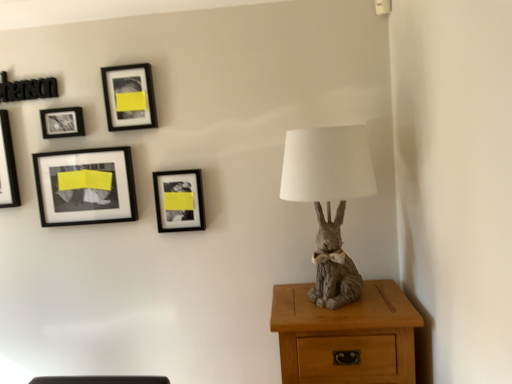
Question: Should I look upward or downward to see black matte picture frame at upper center, the fourth picture frame viewed from the left?

Choices:
 (A) up
 (B) down

Answer: (A)

Question: Is black matte picture frame at upper center, the 2th picture frame in the right-to-left sequence, at the left side of matte black frame at center, the first picture frame viewed from the right?

Choices:
 (A) yes
 (B) no

Answer: (A)

Question: Is the surface of black matte picture frame at upper center, the fourth picture frame viewed from the left, in direct contact with matte black frame at center, the first picture frame viewed from the right?

Choices:
 (A) no
 (B) yes

Answer: (A)

Question: From the image's perspective, does black matte picture frame at upper center, the fourth picture frame viewed from the left, appear lower than matte black frame at center, the first picture frame viewed from the right?

Choices:
 (A) no
 (B) yes

Answer: (A)

Question: Is black matte picture frame at upper center, the fourth picture frame viewed from the left, smaller than matte black frame at center, positioned as the fifth picture frame in left-to-right order?

Choices:
 (A) yes
 (B) no

Answer: (B)

Question: From a real-world perspective, does black matte picture frame at upper center, the 2th picture frame in the right-to-left sequence, stand above matte black frame at center, the first picture frame viewed from the right?

Choices:
 (A) yes
 (B) no

Answer: (A)

Question: Is black matte picture frame at upper center, the 2th picture frame in the right-to-left sequence, at the right side of matte black frame at center, positioned as the fifth picture frame in left-to-right order?

Choices:
 (A) yes
 (B) no

Answer: (B)

Question: Is black matte picture frame at upper left, placed as the third picture frame when sorted from right to left, far from light brown wood nightstand at lower right?

Choices:
 (A) no
 (B) yes

Answer: (A)

Question: Considering the relative positions of black matte picture frame at upper left, the third picture frame positioned from the left, and light brown wood nightstand at lower right in the image provided, is black matte picture frame at upper left, the third picture frame positioned from the left, to the right of light brown wood nightstand at lower right from the viewer's perspective?

Choices:
 (A) no
 (B) yes

Answer: (A)

Question: Is black matte picture frame at upper left, placed as the third picture frame when sorted from right to left, completely or partially outside of light brown wood nightstand at lower right?

Choices:
 (A) yes
 (B) no

Answer: (A)

Question: From a real-world perspective, is black matte picture frame at upper left, the third picture frame positioned from the left, positioned over light brown wood nightstand at lower right based on gravity?

Choices:
 (A) no
 (B) yes

Answer: (B)

Question: Can you confirm if black matte picture frame at upper left, placed as the third picture frame when sorted from right to left, is shorter than light brown wood nightstand at lower right?

Choices:
 (A) yes
 (B) no

Answer: (A)

Question: Considering the relative sizes of black matte picture frame at upper left, placed as the third picture frame when sorted from right to left, and light brown wood nightstand at lower right in the image provided, is black matte picture frame at upper left, placed as the third picture frame when sorted from right to left, thinner than light brown wood nightstand at lower right?

Choices:
 (A) no
 (B) yes

Answer: (B)

Question: Is matte black picture frame at upper left, placed as the 2th picture frame when sorted from left to right, positioned with its back to black glossy picture frame at upper left, which is counted as the first picture frame, starting from the left?

Choices:
 (A) yes
 (B) no

Answer: (B)